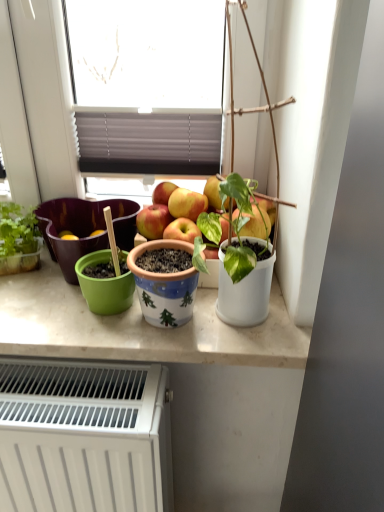
This screenshot has width=384, height=512. What are the coordinates of `vacant area that lies to the right of blue ceramic pot at center, which is the second flowerpot in left-to-right order` in the screenshot? It's located at (244, 327).